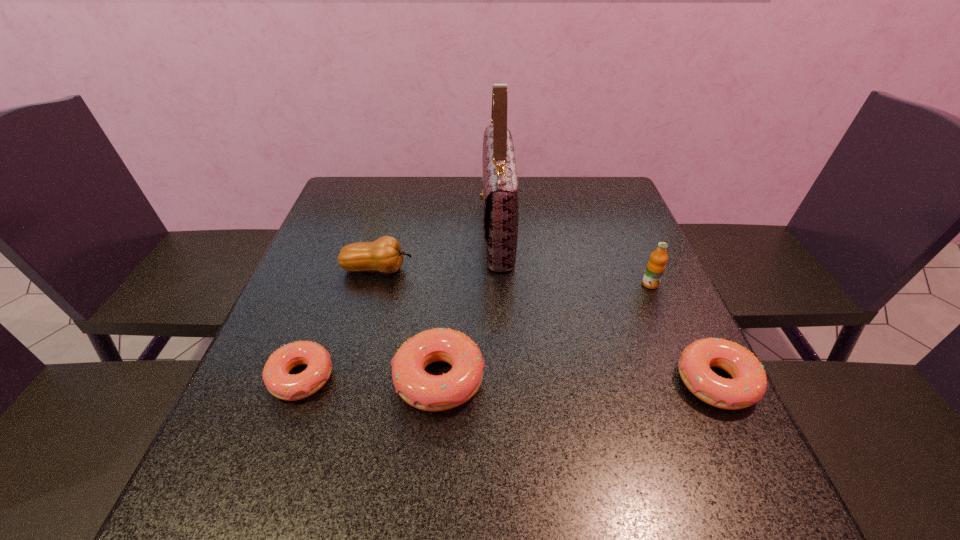
The width and height of the screenshot is (960, 540). What are the coordinates of `the shortest object` in the screenshot? It's located at (281, 384).

At what (x,y) coordinates should I click in order to perform the action: click on the leftmost doughnut. Please return your answer as a coordinate pair (x, y). This screenshot has width=960, height=540. Looking at the image, I should click on (281, 384).

I want to click on the second doughnut from right to left, so click(x=427, y=392).

Where is `the fifth tallest object`? The width and height of the screenshot is (960, 540). the fifth tallest object is located at coordinates (749, 383).

Locate an element on the screen. the rightmost doughnut is located at coordinates (749, 383).

At what (x,y) coordinates should I click in order to perform the action: click on handbag. Please return your answer as a coordinate pair (x, y). Looking at the image, I should click on (500, 198).

Where is `the third tallest object`? This screenshot has height=540, width=960. the third tallest object is located at coordinates (385, 255).

You are a GUI agent. You are given a task and a screenshot of the screen. Output one action in this format:
    pyautogui.click(x=<x>, y=<y>)
    Task: Click on the orange juice
    
    Given the screenshot: What is the action you would take?
    pyautogui.click(x=656, y=265)

This screenshot has width=960, height=540. Find the location of `vacant area situated on the right of the leftmost doughnut`. vacant area situated on the right of the leftmost doughnut is located at coordinates [x=530, y=378].

In order to click on vacant space located 0.170m on the right of the second doughnut from right to left in this screenshot , I will do `click(573, 379)`.